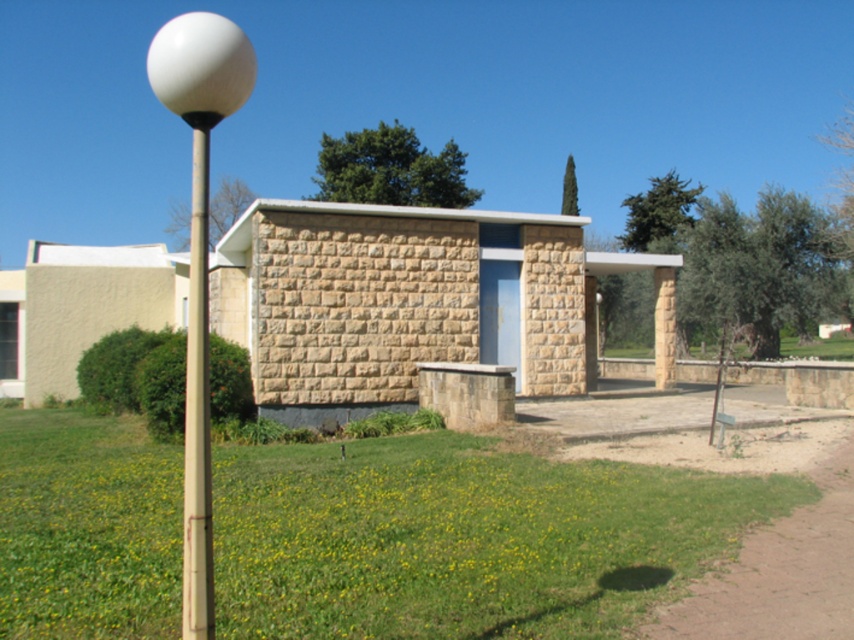
Question: Which point is farther from the camera taking this photo?

Choices:
 (A) (191, 212)
 (B) (203, 28)
 (C) (355, 285)

Answer: (A)

Question: From the image, what is the correct spatial relationship of green grass at lower center in relation to brown stone shelter at center?

Choices:
 (A) left
 (B) right

Answer: (A)

Question: Can you confirm if brown stone shelter at center is bigger than white glossy ball at left?

Choices:
 (A) yes
 (B) no

Answer: (B)

Question: Is brown stone shelter at center below metallic pole at left?

Choices:
 (A) no
 (B) yes

Answer: (B)

Question: Which point appears farthest from the camera in this image?

Choices:
 (A) (481, 513)
 (B) (278, 259)
 (C) (206, 621)

Answer: (B)

Question: Among these points, which one is nearest to the camera?

Choices:
 (A) (200, 316)
 (B) (553, 577)

Answer: (A)